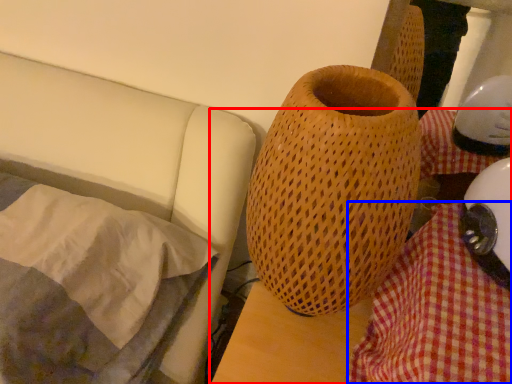
Question: Which point is further to the camera, table (highlighted by a red box) or blanket (highlighted by a blue box)?

Choices:
 (A) table
 (B) blanket

Answer: (B)